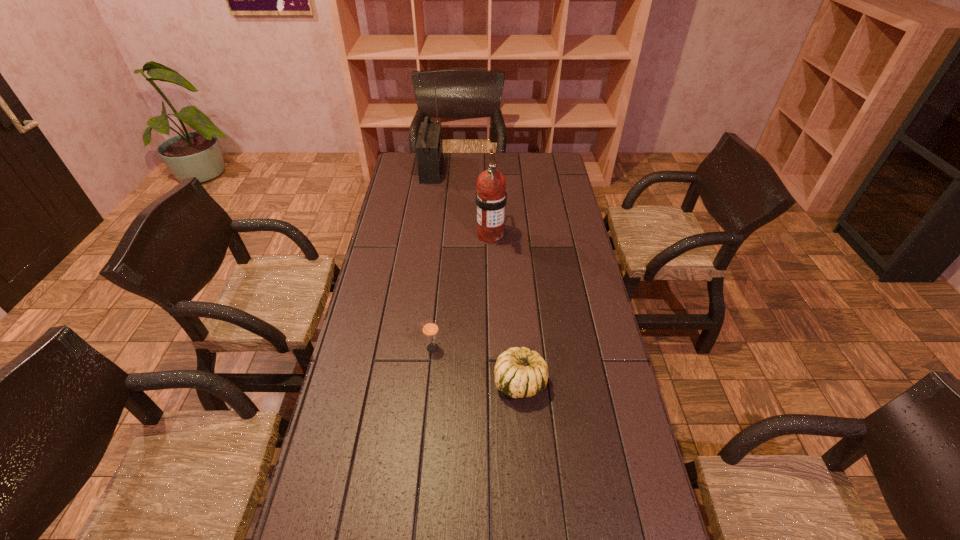
The image size is (960, 540). In order to click on vacant point that satisfies the following two spatial constraints: 1. on the back side of the straw; 2. on the front panel of the farthest object in this screenshot , I will do `click(449, 170)`.

Find the location of a particular element. free spot that satisfies the following two spatial constraints: 1. on the front panel of the farthest object; 2. on the back side of the third object from right to left is located at coordinates (405, 348).

I want to click on free location that satisfies the following two spatial constraints: 1. on the front panel of the leftmost object; 2. on the back side of the third tallest object, so click(405, 348).

Locate an element on the screen. The image size is (960, 540). free location that satisfies the following two spatial constraints: 1. on the front panel of the radio receiver; 2. on the left side of the gourd is located at coordinates pyautogui.click(x=400, y=382).

I want to click on free space that satisfies the following two spatial constraints: 1. on the front panel of the farthest object; 2. on the right side of the third object from right to left, so click(405, 348).

Identify the location of free space that satisfies the following two spatial constraints: 1. on the front panel of the second object from left to right; 2. on the right side of the leftmost object. The height and width of the screenshot is (540, 960). (405, 348).

The width and height of the screenshot is (960, 540). Identify the location of free spot that satisfies the following two spatial constraints: 1. at the nozzle of the shortest object; 2. on the right side of the third nearest object. (494, 382).